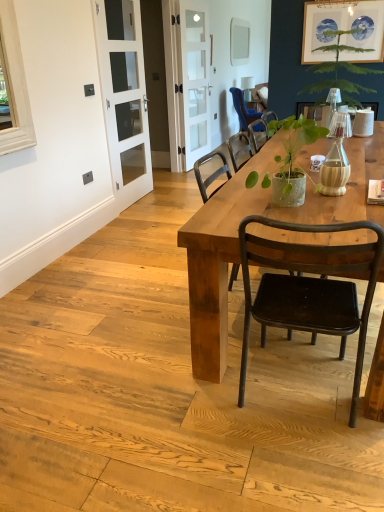
Question: Does clear glass door at center, the 1th screen door in the back-to-front sequence, have a lesser height compared to blue fabric chair at upper center, placed as the second chair when sorted from bottom to top?

Choices:
 (A) yes
 (B) no

Answer: (B)

Question: Can you confirm if clear glass door at center, the 2th screen door positioned from the front, is taller than blue fabric chair at upper center, the 2th chair from the front?

Choices:
 (A) no
 (B) yes

Answer: (B)

Question: Considering the relative positions of clear glass door at center, which ranks as the first screen door in right-to-left order, and blue fabric chair at upper center, which appears as the 1th chair when viewed from the top, in the image provided, is clear glass door at center, which ranks as the first screen door in right-to-left order, behind blue fabric chair at upper center, which appears as the 1th chair when viewed from the top,?

Choices:
 (A) yes
 (B) no

Answer: (B)

Question: Does clear glass door at center, the 1th screen door in the back-to-front sequence, appear on the left side of blue fabric chair at upper center, the first chair in the back-to-front sequence?

Choices:
 (A) yes
 (B) no

Answer: (A)

Question: Is clear glass door at center, which ranks as the first screen door in right-to-left order, looking in the opposite direction of blue fabric chair at upper center, placed as the second chair when sorted from bottom to top?

Choices:
 (A) no
 (B) yes

Answer: (A)

Question: Considering the positions of wooden table at center and matte gray power outlet at upper left in the image, is wooden table at center wider or thinner than matte gray power outlet at upper left?

Choices:
 (A) wide
 (B) thin

Answer: (A)

Question: Is wooden table at center inside or outside of matte gray power outlet at upper left?

Choices:
 (A) inside
 (B) outside

Answer: (B)

Question: Would you say wooden table at center is to the left or to the right of matte gray power outlet at upper left in the picture?

Choices:
 (A) right
 (B) left

Answer: (A)

Question: Is wooden table at center taller or shorter than matte gray power outlet at upper left?

Choices:
 (A) short
 (B) tall

Answer: (B)

Question: Based on their sizes in the image, would you say green leafy plant at upper right is bigger or smaller than green textured pot at center?

Choices:
 (A) big
 (B) small

Answer: (A)

Question: Is point (340, 84) positioned closer to the camera than point (268, 132)?

Choices:
 (A) farther
 (B) closer

Answer: (A)

Question: From the image's perspective, is green leafy plant at upper right located above or below green textured pot at center?

Choices:
 (A) below
 (B) above

Answer: (B)

Question: Considering the positions of green leafy plant at upper right and green textured pot at center in the image, is green leafy plant at upper right wider or thinner than green textured pot at center?

Choices:
 (A) thin
 (B) wide

Answer: (B)

Question: Do you think white glass screen door at left, which is counted as the second screen door, starting from the back, is within clear glass door at center, the second screen door in the left-to-right sequence, or outside of it?

Choices:
 (A) inside
 (B) outside

Answer: (B)

Question: From a real-world perspective, is white glass screen door at left, which is counted as the second screen door, starting from the back, above or below clear glass door at center, the 1th screen door in the back-to-front sequence?

Choices:
 (A) above
 (B) below

Answer: (B)